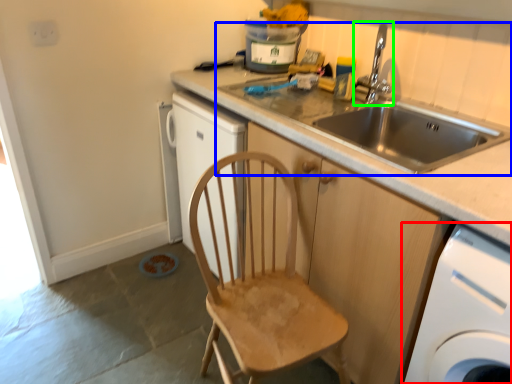
Question: Which is nearer to the home appliance (highlighted by a red box)? sink (highlighted by a blue box) or tap (highlighted by a green box).

Choices:
 (A) sink
 (B) tap

Answer: (A)